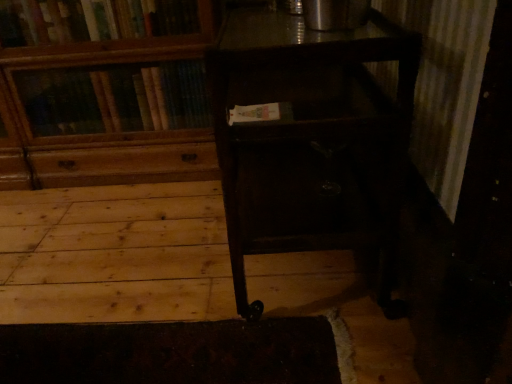
Question: Considering the positions of point (7, 182) and point (300, 200), is point (7, 182) closer or farther from the camera than point (300, 200)?

Choices:
 (A) closer
 (B) farther

Answer: (B)

Question: Considering the positions of wooden bookcase at upper left and dark wood table at center in the image, is wooden bookcase at upper left bigger or smaller than dark wood table at center?

Choices:
 (A) small
 (B) big

Answer: (B)

Question: From a real-world perspective, relative to dark wood table at center, is wooden bookcase at upper left vertically above or below?

Choices:
 (A) below
 (B) above

Answer: (B)

Question: Considering their positions, is dark wood table at center located in front of or behind wooden bookcase at upper left?

Choices:
 (A) front
 (B) behind

Answer: (A)

Question: Looking at their shapes, would you say dark wood table at center is wider or thinner than wooden bookcase at upper left?

Choices:
 (A) thin
 (B) wide

Answer: (B)

Question: In the image, is dark wood table at center on the left side or the right side of wooden bookcase at upper left?

Choices:
 (A) left
 (B) right

Answer: (B)

Question: From a real-world perspective, is dark wood table at center positioned above or below wooden bookcase at upper left?

Choices:
 (A) above
 (B) below

Answer: (B)